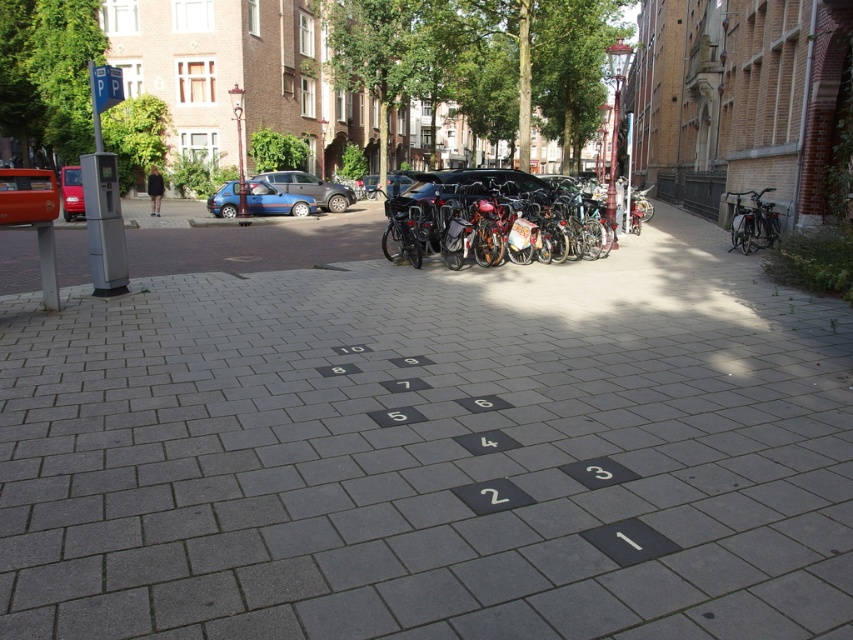
Question: Which point is closer to the camera taking this photo?

Choices:
 (A) (13, 177)
 (B) (770, 208)

Answer: (A)

Question: Is gray concrete pavement at center below shiny metallic bicycles at center?

Choices:
 (A) no
 (B) yes

Answer: (B)

Question: Is matte blue van at center above shiny metallic bicycle at right?

Choices:
 (A) no
 (B) yes

Answer: (B)

Question: Among these points, which one is nearest to the camera?

Choices:
 (A) [x=227, y=208]
 (B) [x=317, y=202]
 (C) [x=70, y=180]
 (D) [x=727, y=428]

Answer: (D)

Question: Does matte red car at left have a lesser width compared to shiny metallic bicycle at right?

Choices:
 (A) no
 (B) yes

Answer: (B)

Question: Estimate the real-world distances between objects in this image. Which object is closer to the shiny metallic bicycles at center?

Choices:
 (A) shiny metallic bicycle at right
 (B) metallic blue car at center
 (C) matte red car at left
 (D) blue metallic car at center

Answer: (A)